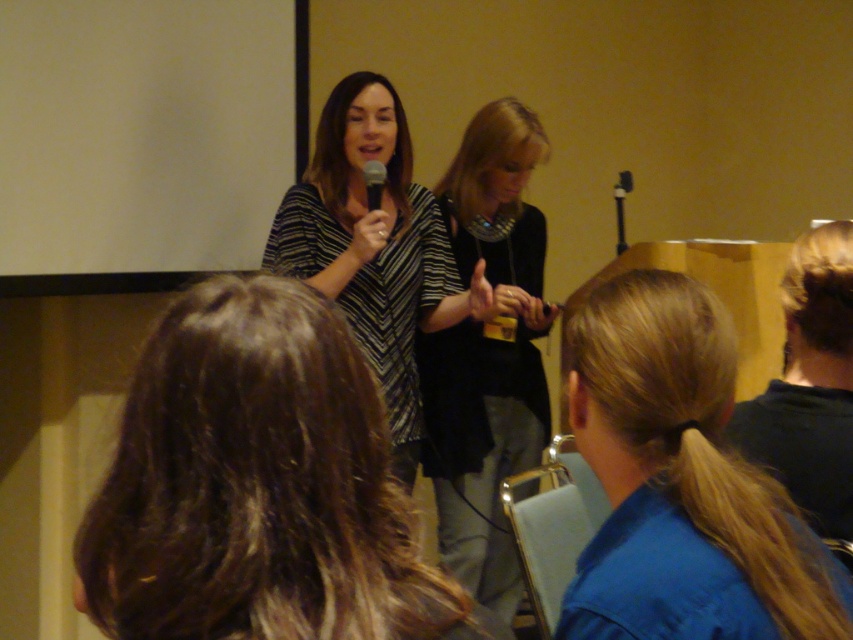
Question: Which object appears farthest from the camera in this image?

Choices:
 (A) matte black microphone at center
 (B) striped fabric dress at center
 (C) blonde hair at lower right

Answer: (A)

Question: Does black fabric dress at center have a smaller size compared to striped fabric dress at center?

Choices:
 (A) no
 (B) yes

Answer: (B)

Question: Does brown wavy hair at center appear under black fabric dress at center?

Choices:
 (A) yes
 (B) no

Answer: (B)

Question: Is brown wavy hair at center smaller than striped fabric dress at center?

Choices:
 (A) yes
 (B) no

Answer: (A)

Question: Which object appears farthest from the camera in this image?

Choices:
 (A) brown wavy hair at center
 (B) black fabric dress at center
 (C) matte black microphone at center

Answer: (B)

Question: Estimate the real-world distances between objects in this image. Which object is closer to the black fabric dress at center?

Choices:
 (A) striped fabric dress at center
 (B) brown wavy hair at center

Answer: (A)